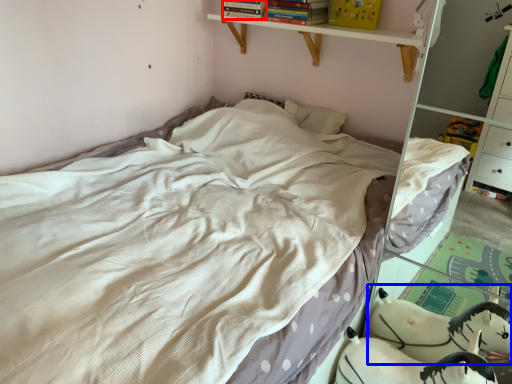
Question: Which object appears closest to the camera in this image, book (highlighted by a red box) or animal (highlighted by a blue box)?

Choices:
 (A) book
 (B) animal

Answer: (B)